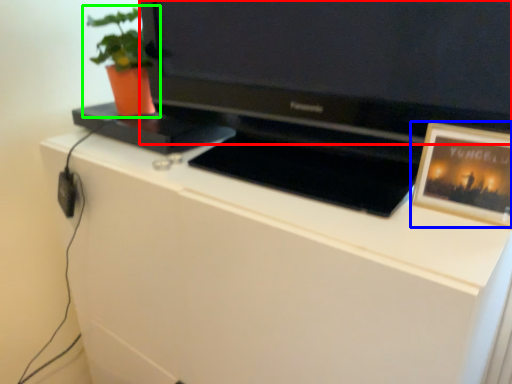
Question: Considering the real-world distances, which object is closest to television (highlighted by a red box)? picture frame (highlighted by a blue box) or houseplant (highlighted by a green box).

Choices:
 (A) picture frame
 (B) houseplant

Answer: (A)